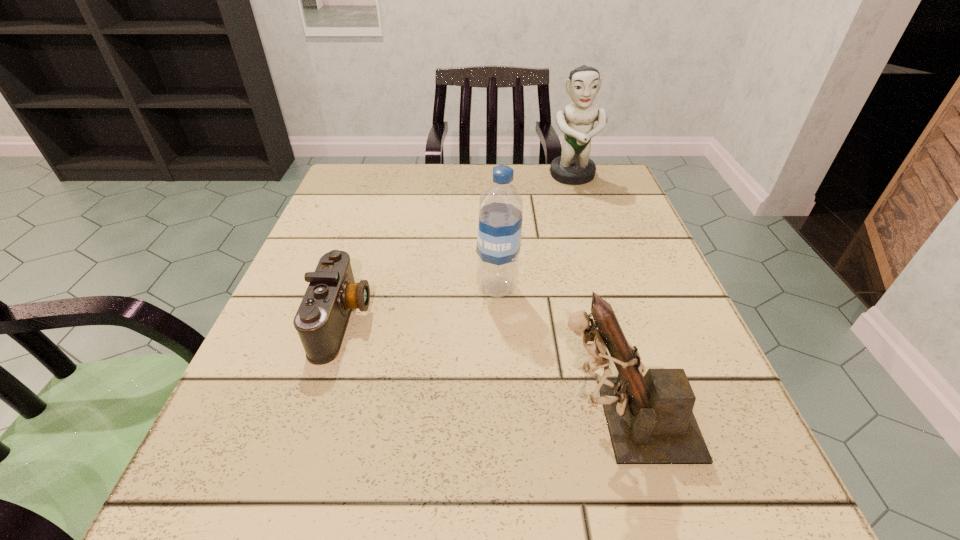
Where is `the farther figurine`? The height and width of the screenshot is (540, 960). the farther figurine is located at coordinates (573, 167).

Image resolution: width=960 pixels, height=540 pixels. I want to click on the nearer figurine, so click(x=650, y=419).

I want to click on water bottle, so click(500, 211).

This screenshot has width=960, height=540. Find the location of `camera`. camera is located at coordinates (321, 320).

At what (x,y) coordinates should I click in order to perform the action: click on the leftmost object. Please return your answer as a coordinate pair (x, y). Looking at the image, I should click on (321, 320).

The width and height of the screenshot is (960, 540). I want to click on free point located on the front-facing side of the farthest object, so click(601, 264).

At what (x,y) coordinates should I click in order to perform the action: click on vacant area located on the front-facing side of the nearer figurine. Please return your answer as a coordinate pair (x, y). This screenshot has width=960, height=540. Looking at the image, I should click on (476, 420).

In order to click on free space located on the front-facing side of the nearer figurine in this screenshot , I will do `click(431, 420)`.

Find the location of a particular element. vacant space located 0.260m on the front-facing side of the nearer figurine is located at coordinates (357, 420).

I want to click on vacant space located on the label of the water bottle, so click(287, 288).